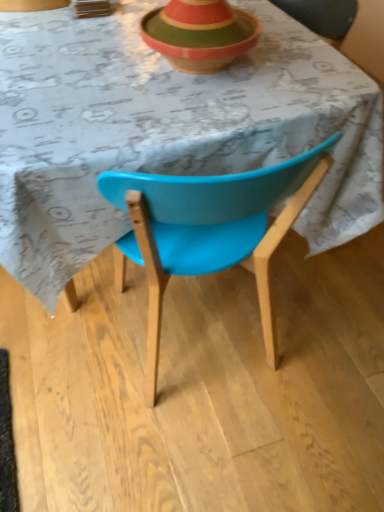
Question: Could you tell me if blue plastic chair at center is facing wooden striped bowl at upper center?

Choices:
 (A) no
 (B) yes

Answer: (A)

Question: Does blue plastic chair at center come in front of wooden striped bowl at upper center?

Choices:
 (A) yes
 (B) no

Answer: (A)

Question: Can you confirm if blue plastic chair at center is smaller than wooden striped bowl at upper center?

Choices:
 (A) no
 (B) yes

Answer: (A)

Question: From a real-world perspective, is blue plastic chair at center positioned under wooden striped bowl at upper center based on gravity?

Choices:
 (A) yes
 (B) no

Answer: (A)

Question: Does blue plastic chair at center appear on the right side of wooden striped bowl at upper center?

Choices:
 (A) yes
 (B) no

Answer: (B)

Question: Can you confirm if blue plastic chair at center is shorter than wooden striped bowl at upper center?

Choices:
 (A) no
 (B) yes

Answer: (A)

Question: Is blue plastic chair at center located within wooden striped bowl at upper center?

Choices:
 (A) no
 (B) yes

Answer: (A)

Question: Can you confirm if wooden striped bowl at upper center is bigger than blue plastic chair at center?

Choices:
 (A) yes
 (B) no

Answer: (B)

Question: Considering the relative sizes of wooden striped bowl at upper center and blue plastic chair at center in the image provided, is wooden striped bowl at upper center taller than blue plastic chair at center?

Choices:
 (A) yes
 (B) no

Answer: (B)

Question: Considering the relative positions of wooden striped bowl at upper center and blue plastic chair at center in the image provided, is wooden striped bowl at upper center to the right of blue plastic chair at center from the viewer's perspective?

Choices:
 (A) no
 (B) yes

Answer: (B)

Question: Can you confirm if wooden striped bowl at upper center is thinner than blue plastic chair at center?

Choices:
 (A) yes
 (B) no

Answer: (A)

Question: Is wooden striped bowl at upper center in front of blue plastic chair at center?

Choices:
 (A) no
 (B) yes

Answer: (A)

Question: Is point (23, 65) positioned closer to the camera than point (170, 40)?

Choices:
 (A) farther
 (B) closer

Answer: (A)